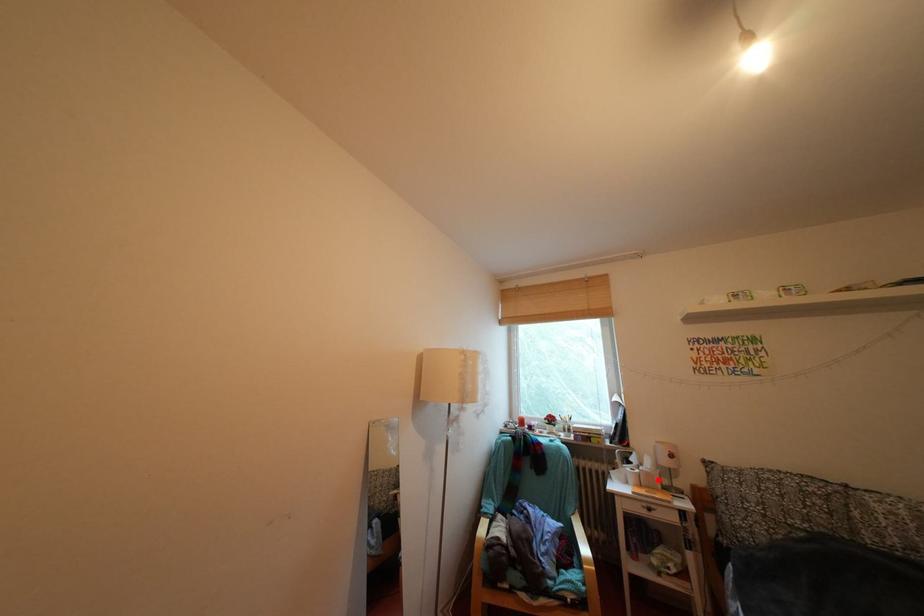
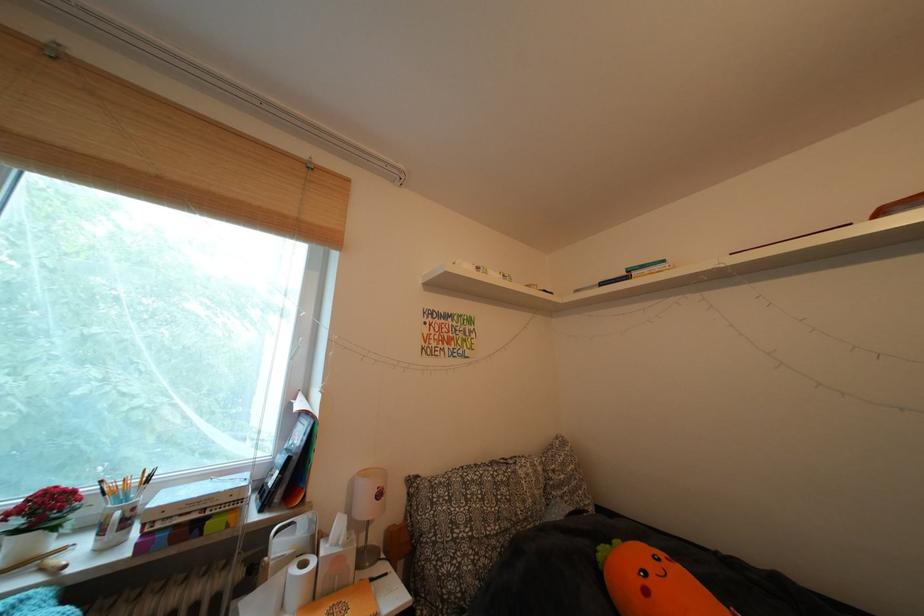
Find the pixel in the second image that matches the highlighted location in the first image.

(346, 565)